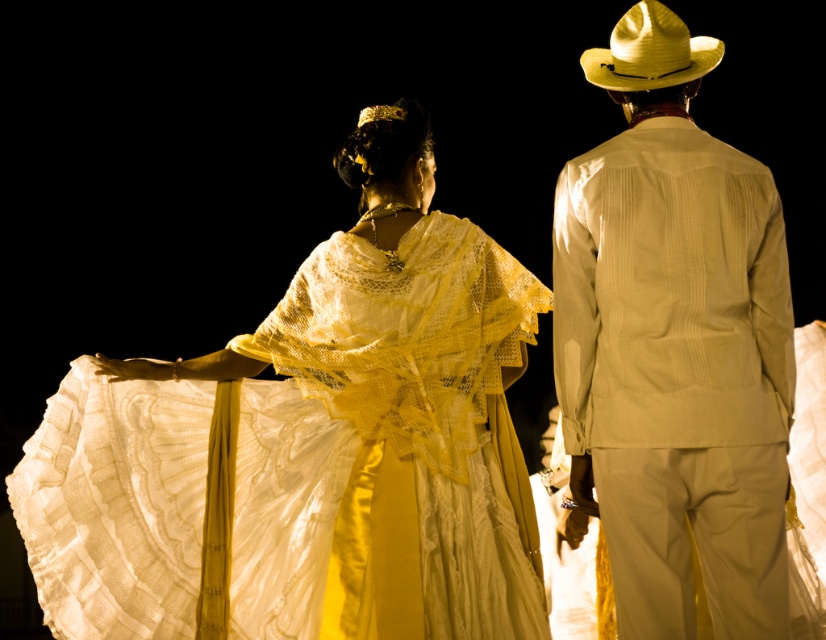
You are a stagehand in a theater and need to move a 15 feet long ladder from the matte white lace dress at center to the straw cowboy hat at upper right. Can you safely transport the ladder horizontally without tilting it? Please explain your reasoning.

The distance between the matte white lace dress at center and the straw cowboy hat at upper right is 18.37 feet. Since the ladder is 15 feet long, it can be transported horizontally as the available space is greater than the ladder length.

You are a photographer positioned at the camera. You want to capture a closeup shot of the matte white lace dress at center. Given that your camera can focus on subjects within 10 meters, will you be able to achieve this?

The matte white lace dress at center is 15.17 meters away from the camera, which is beyond the 10 meter focusing range. Therefore, capturing a closeup shot would not be possible with the current camera settings.